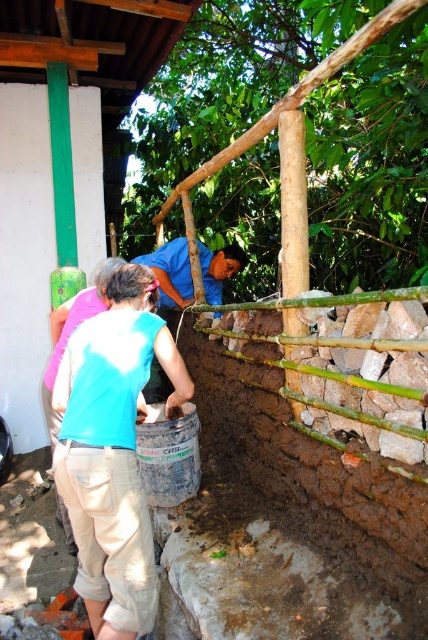
Which is more to the left, blue shirt at center or khaki pants at lower left?

Positioned to the left is khaki pants at lower left.

Describe the element at coordinates (171, 276) in the screenshot. I see `blue shirt at center` at that location.

Does point (187, 253) come behind point (55, 339)?

Yes.

Where is `blue shirt at center`? blue shirt at center is located at coordinates (171, 276).

Between point (118, 636) and point (237, 259), which one is positioned in front?

Point (118, 636)

Is point (79, 499) positioned before point (133, 260)?

Yes.

Image resolution: width=428 pixels, height=640 pixels. I want to click on matte blue shirt at center, so click(112, 451).

Which of these two, matte blue shirt at center or khaki pants at lower left, stands taller?

matte blue shirt at center is taller.

Can you confirm if matte blue shirt at center is wider than khaki pants at lower left?

No.

Who is more distant from viewer, (98, 394) or (50, 448)?

The point (50, 448) is behind.

This screenshot has height=640, width=428. I want to click on matte blue shirt at center, so click(x=112, y=451).